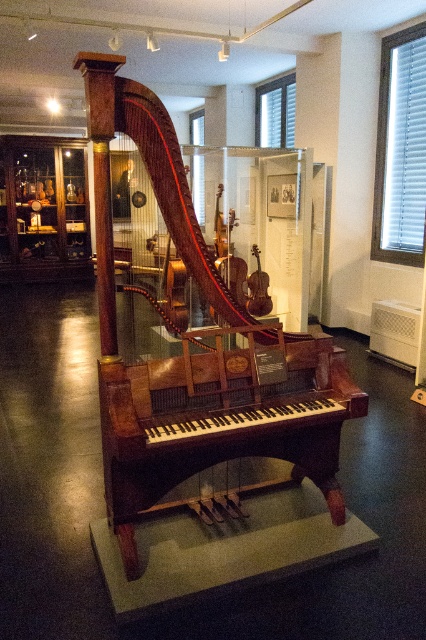
Question: Which point appears closest to the camera in this image?

Choices:
 (A) (143, 452)
 (B) (256, 273)

Answer: (A)

Question: Estimate the real-world distances between objects in this image. Which object is closer to the wooden violin at center?

Choices:
 (A) mahogany wood harpsichord at center
 (B) wooden harpsichord at center

Answer: (B)

Question: In this image, where is wooden harpsichord at center located relative to mahogany wood harpsichord at center?

Choices:
 (A) below
 (B) above

Answer: (B)

Question: Does mahogany wood harpsichord at center appear on the right side of wooden violin at center?

Choices:
 (A) no
 (B) yes

Answer: (A)

Question: Is wooden harpsichord at center closer to camera compared to mahogany wood harpsichord at center?

Choices:
 (A) yes
 (B) no

Answer: (B)

Question: Among these objects, which one is nearest to the camera?

Choices:
 (A) mahogany wood harpsichord at center
 (B) wooden harpsichord at center

Answer: (A)